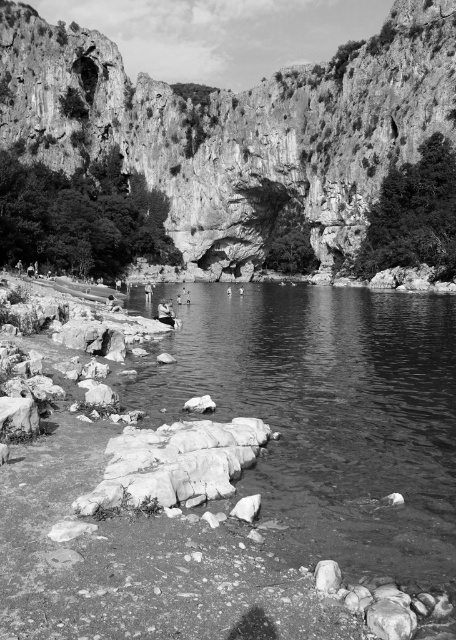
In the scene shown: Does transparent water at lower left have a lesser width compared to smooth gray rock at lower left?

No.

Between point (301, 340) and point (113, 461), which one is positioned behind?

The point (301, 340) is more distant.

Where is `transparent water at lower left`? The width and height of the screenshot is (456, 640). transparent water at lower left is located at coordinates (330, 417).

Is rugged stone cliff at upper center taller than transparent water at lower left?

Yes, rugged stone cliff at upper center is taller than transparent water at lower left.

Which is behind, point (284, 88) or point (306, 353)?

Point (284, 88)

What do you see at coordinates (238, 128) in the screenshot? This screenshot has height=640, width=456. I see `rugged stone cliff at upper center` at bounding box center [238, 128].

You are a GUI agent. You are given a task and a screenshot of the screen. Output one action in this format:
    pyautogui.click(x=<x>, y=<y>)
    Task: Click on the rugged stone cliff at upper center
    The height and width of the screenshot is (640, 456).
    Given the screenshot: What is the action you would take?
    pyautogui.click(x=238, y=128)

Does rugged stone cliff at upper center appear on the left side of smooth gray rock at lower left?

Indeed, rugged stone cliff at upper center is positioned on the left side of smooth gray rock at lower left.

Between point (94, 81) and point (167, 481), which one is positioned behind?

Positioned behind is point (94, 81).

Is point (62, 115) closer to camera compared to point (176, 456)?

That is False.

Find the location of a particular element. The image size is (456, 640). rugged stone cliff at upper center is located at coordinates (238, 128).